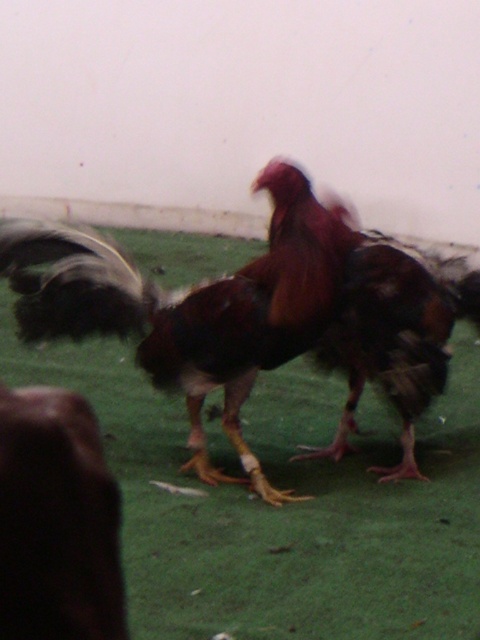
Which of these two, green artificial turf at center or brown feathered rooster at center, stands shorter?

green artificial turf at center

Is point (142, 384) positioned before point (194, 388)?

No, it is behind (194, 388).

Is point (440, 504) behind point (218, 321)?

Yes, it is.

The height and width of the screenshot is (640, 480). What are the coordinates of `green artificial turf at center` in the screenshot? It's located at (284, 506).